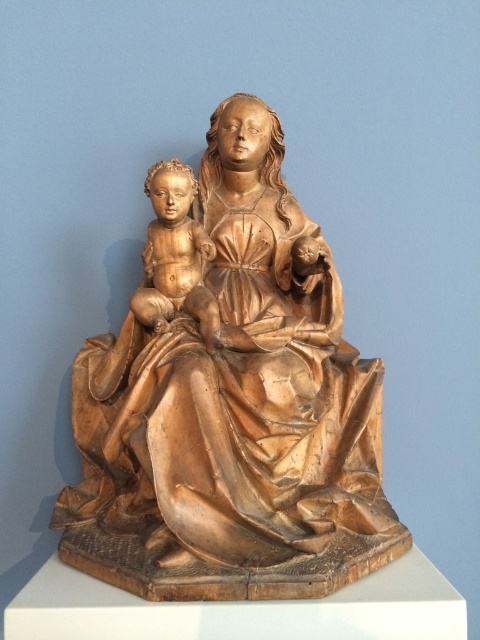
Question: Does wooden statue at center appear on the left side of wooden baby at center?

Choices:
 (A) yes
 (B) no

Answer: (B)

Question: Among these objects, which one is farthest from the camera?

Choices:
 (A) wooden baby at center
 (B) wooden statue at center

Answer: (A)

Question: Which point is farther from the camera taking this photo?

Choices:
 (A) (333, 502)
 (B) (157, 164)

Answer: (B)

Question: Is wooden statue at center in front of wooden baby at center?

Choices:
 (A) no
 (B) yes

Answer: (B)

Question: Does wooden statue at center have a larger size compared to wooden baby at center?

Choices:
 (A) yes
 (B) no

Answer: (A)